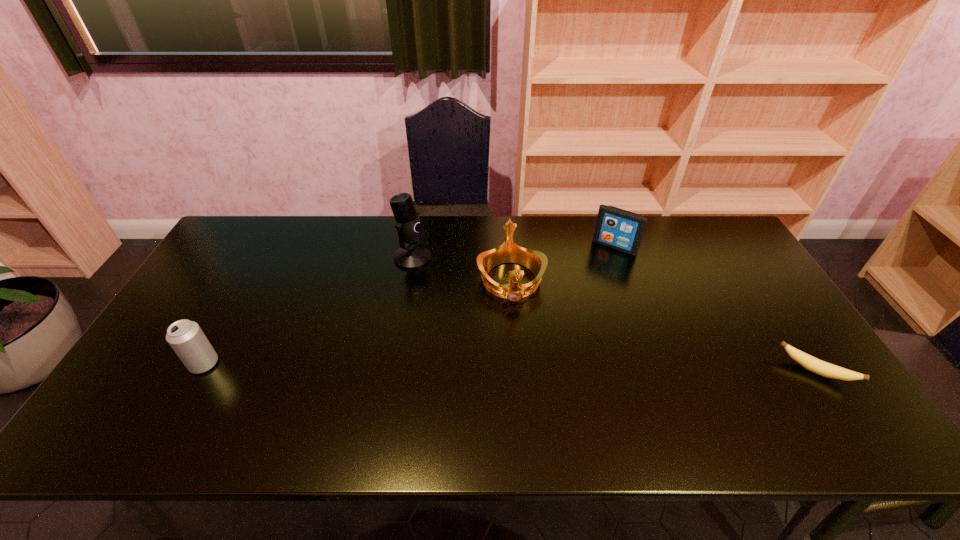
Where is `the leftmost object`? the leftmost object is located at coordinates (186, 338).

Image resolution: width=960 pixels, height=540 pixels. Identify the location of banana. (815, 365).

Locate an element on the screen. The width and height of the screenshot is (960, 540). the rightmost object is located at coordinates (815, 365).

Where is `tiara`? The width and height of the screenshot is (960, 540). tiara is located at coordinates (509, 251).

Identify the location of the tallest object. The height and width of the screenshot is (540, 960). (410, 230).

Locate an element on the screen. the second object from left to right is located at coordinates (410, 230).

The height and width of the screenshot is (540, 960). Identify the location of iPod. (616, 228).

At what (x,y) coordinates should I click in order to perform the action: click on free space located on the right of the leftmost object. Please return your answer as a coordinate pair (x, y). Looking at the image, I should click on (245, 363).

Locate an element on the screen. free space located 0.180m on the back of the shortest object is located at coordinates (770, 303).

At what (x,y) coordinates should I click in order to perform the action: click on free spot located 0.260m at the front emblem of the tiara. Please return your answer as a coordinate pair (x, y). Looking at the image, I should click on (524, 390).